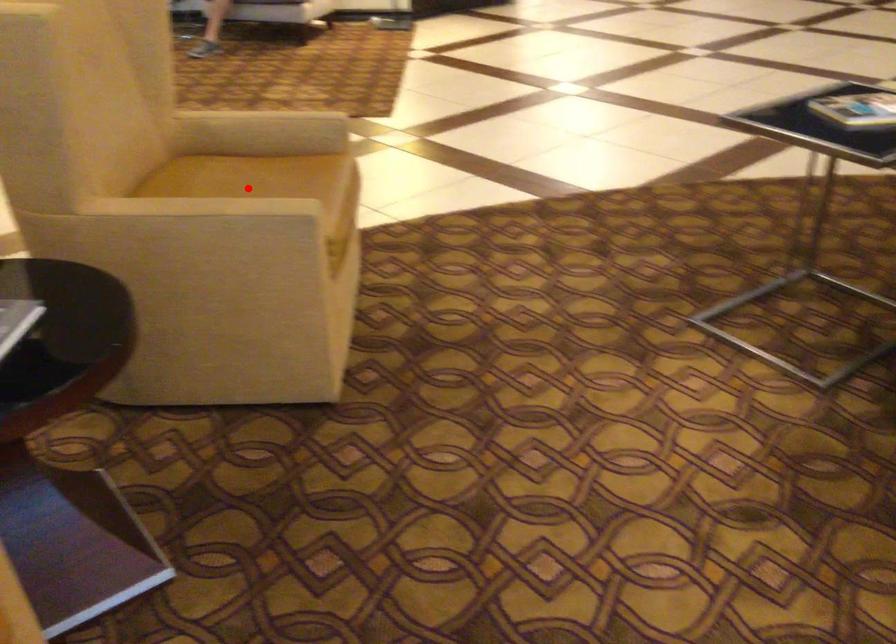
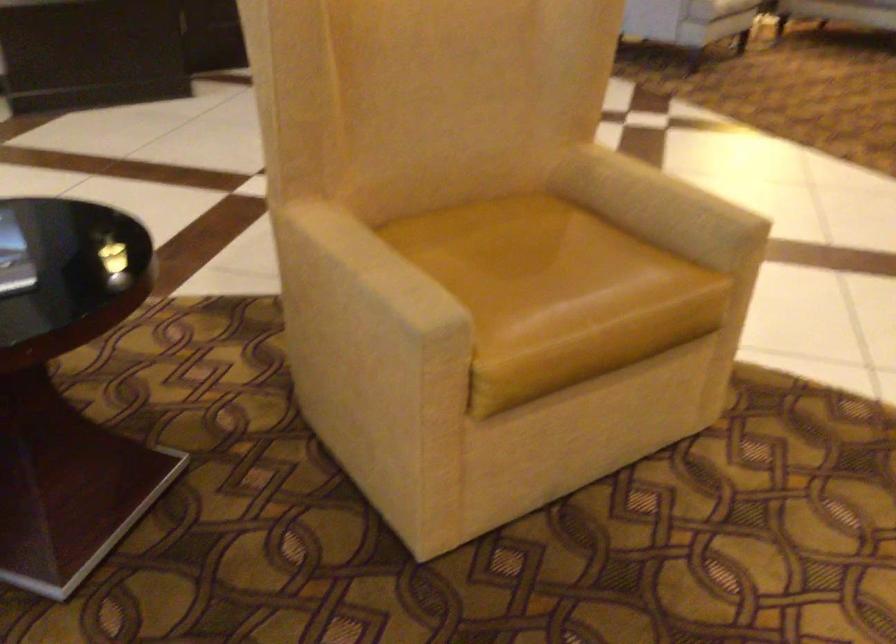
Question: I am providing you with two images of the same scene from different viewpoints. In image1, a red point is highlighted. Considering the same 3D point in image2, which of the following is correct?

Choices:
 (A) It is closer
 (B) It is farther

Answer: (A)